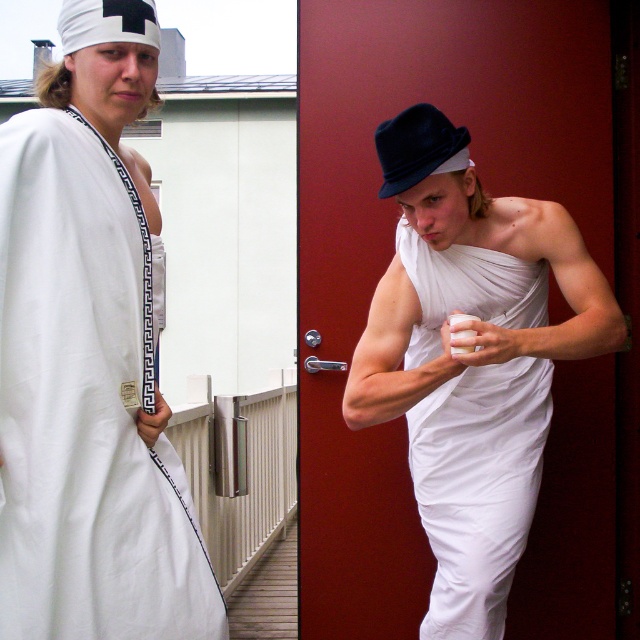
Looking at this image, can you confirm if white cloth at left is bigger than navy blue felt hat at upper center?

Indeed, white cloth at left has a larger size compared to navy blue felt hat at upper center.

Between point (61, 100) and point (394, 173), which one is positioned in front?

Point (61, 100) is in front.

This screenshot has height=640, width=640. Identify the location of white cloth at left. (88, 374).

Where is `white cloth at left`? The height and width of the screenshot is (640, 640). white cloth at left is located at coordinates (88, 374).

Is white cloth at left positioned before white fabric headband at upper left?

That is True.

Which is above, white cloth at left or white fabric headband at upper left?

white fabric headband at upper left is above.

The width and height of the screenshot is (640, 640). What do you see at coordinates (88, 374) in the screenshot?
I see `white cloth at left` at bounding box center [88, 374].

Find the location of a particular element. white cloth at left is located at coordinates (88, 374).

Measure the distance between white fabric toga at center and camera.

A distance of 1.98 meters exists between white fabric toga at center and camera.

Which is in front, point (460, 323) or point (108, 38)?

Point (108, 38) is more forward.

Which is in front, point (502, 356) or point (125, 26)?

Point (125, 26) is more forward.

Locate an element on the screen. This screenshot has height=640, width=640. white fabric toga at center is located at coordinates (470, 356).